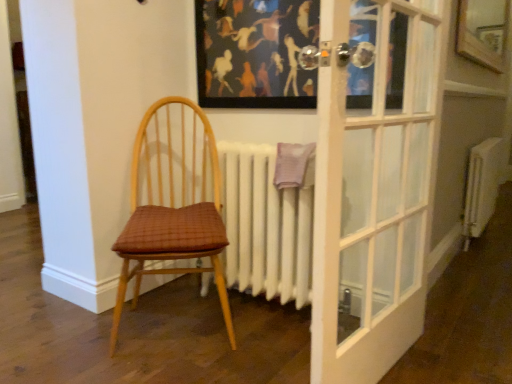
Question: Should I look upward or downward to see wooden chair with woven seat cushion at left?

Choices:
 (A) down
 (B) up

Answer: (A)

Question: Is wooden chair with woven seat cushion at left at the right side of matte black picture frame at upper center?

Choices:
 (A) yes
 (B) no

Answer: (B)

Question: From the image's perspective, is wooden chair with woven seat cushion at left located above matte black picture frame at upper center?

Choices:
 (A) no
 (B) yes

Answer: (A)

Question: From a real-world perspective, is wooden chair with woven seat cushion at left located beneath matte black picture frame at upper center?

Choices:
 (A) no
 (B) yes

Answer: (B)

Question: Is wooden chair with woven seat cushion at left outside matte black picture frame at upper center?

Choices:
 (A) yes
 (B) no

Answer: (A)

Question: Is wooden chair with woven seat cushion at left positioned far away from matte black picture frame at upper center?

Choices:
 (A) yes
 (B) no

Answer: (B)

Question: Considering the relative positions of wooden chair with woven seat cushion at left and matte black picture frame at upper center in the image provided, is wooden chair with woven seat cushion at left behind matte black picture frame at upper center?

Choices:
 (A) yes
 (B) no

Answer: (B)

Question: Is white metallic radiator at right, marked as the first radiator in a right-to-left arrangement, closer to camera compared to wooden chair with woven seat cushion at left?

Choices:
 (A) no
 (B) yes

Answer: (A)

Question: Could you tell me if white metallic radiator at right, marked as the first radiator in a right-to-left arrangement, is facing wooden chair with woven seat cushion at left?

Choices:
 (A) yes
 (B) no

Answer: (B)

Question: Is white metallic radiator at right, marked as the first radiator in a right-to-left arrangement, smaller than wooden chair with woven seat cushion at left?

Choices:
 (A) yes
 (B) no

Answer: (A)

Question: Is white metallic radiator at right, marked as the first radiator in a right-to-left arrangement, bigger than wooden chair with woven seat cushion at left?

Choices:
 (A) yes
 (B) no

Answer: (B)

Question: From a real-world perspective, does white metallic radiator at right, which is the 1th radiator in back-to-front order, sit lower than wooden chair with woven seat cushion at left?

Choices:
 (A) yes
 (B) no

Answer: (A)

Question: Considering the relative sizes of white metallic radiator at right, which ranks as the 2th radiator in front-to-back order, and wooden chair with woven seat cushion at left in the image provided, is white metallic radiator at right, which ranks as the 2th radiator in front-to-back order, thinner than wooden chair with woven seat cushion at left?

Choices:
 (A) no
 (B) yes

Answer: (B)

Question: From the image's perspective, would you say white matte radiator at center, the 2th radiator from the back, is positioned over wooden chair with woven seat cushion at left?

Choices:
 (A) yes
 (B) no

Answer: (B)